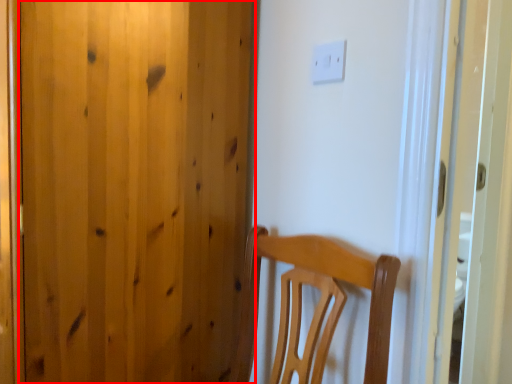
Question: From the image's perspective, what is the correct spatial relationship of door (annotated by the red box) in relation to light switch?

Choices:
 (A) above
 (B) below

Answer: (B)